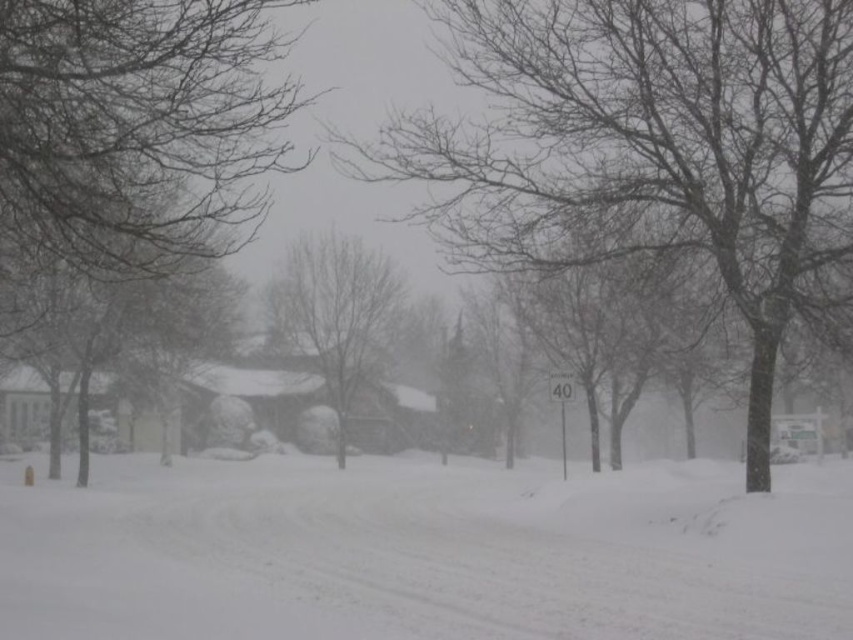
Measure the distance between white fluffy snow at center and camera.

white fluffy snow at center is 8.42 meters from camera.

Which of these two, white fluffy snow at center or bare branches at left, stands shorter?

Standing shorter between the two is white fluffy snow at center.

I want to click on white fluffy snow at center, so click(x=424, y=550).

Looking at this image, is snow-covered tree at center shorter than bare branches at left?

Yes, snow-covered tree at center is shorter than bare branches at left.

Is point (737, 76) less distant than point (195, 218)?

Yes, it is in front of point (195, 218).

The height and width of the screenshot is (640, 853). What do you see at coordinates (646, 148) in the screenshot? I see `snow-covered tree at center` at bounding box center [646, 148].

Locate an element on the screen. snow-covered tree at center is located at coordinates (646, 148).

Does bare branches at left have a lesser height compared to bare wood tree at center?

No, bare branches at left is not shorter than bare wood tree at center.

Describe the element at coordinates (137, 129) in the screenshot. The height and width of the screenshot is (640, 853). I see `bare branches at left` at that location.

This screenshot has width=853, height=640. In order to click on bare branches at left in this screenshot , I will do `click(137, 129)`.